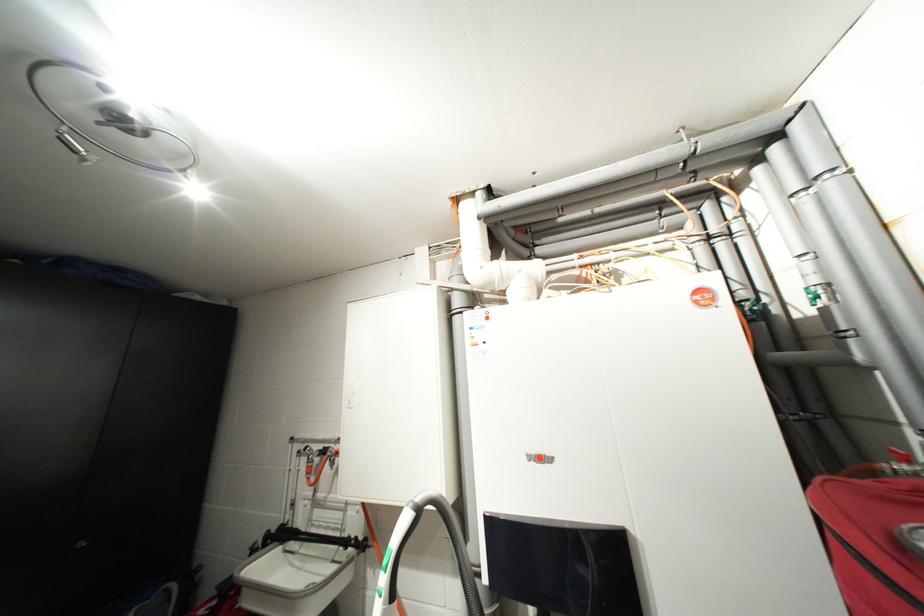
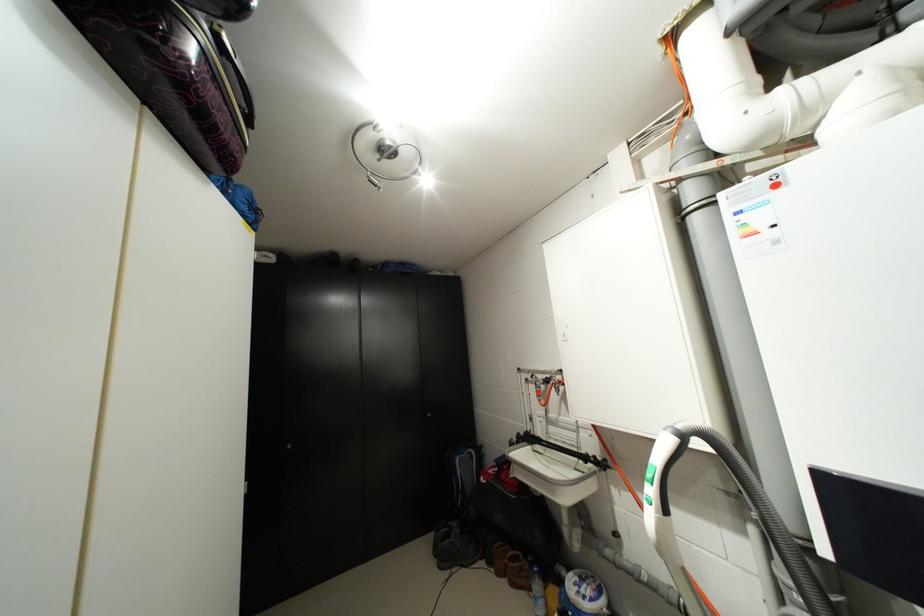
In the second image, find the point that corresponds to point (418, 506) in the first image.

(676, 431)